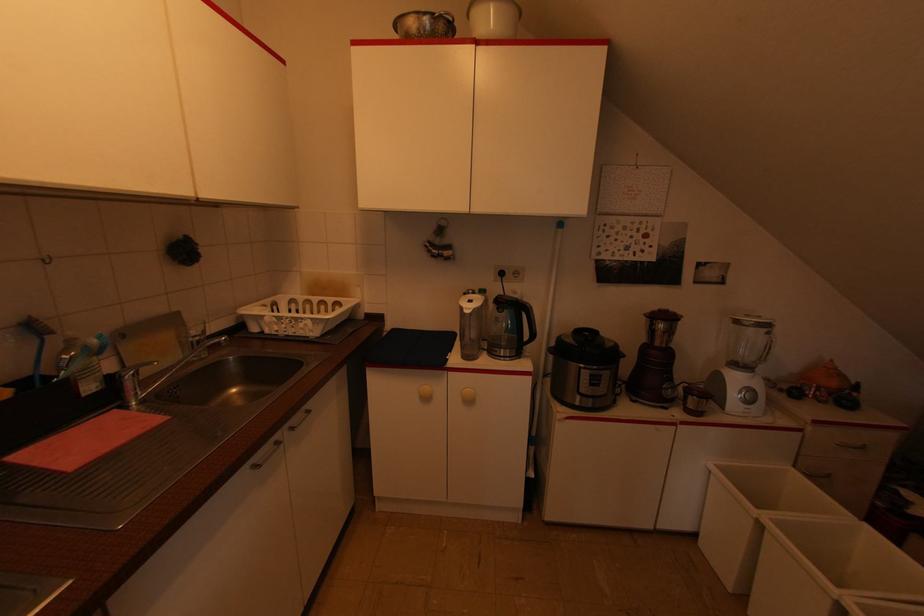
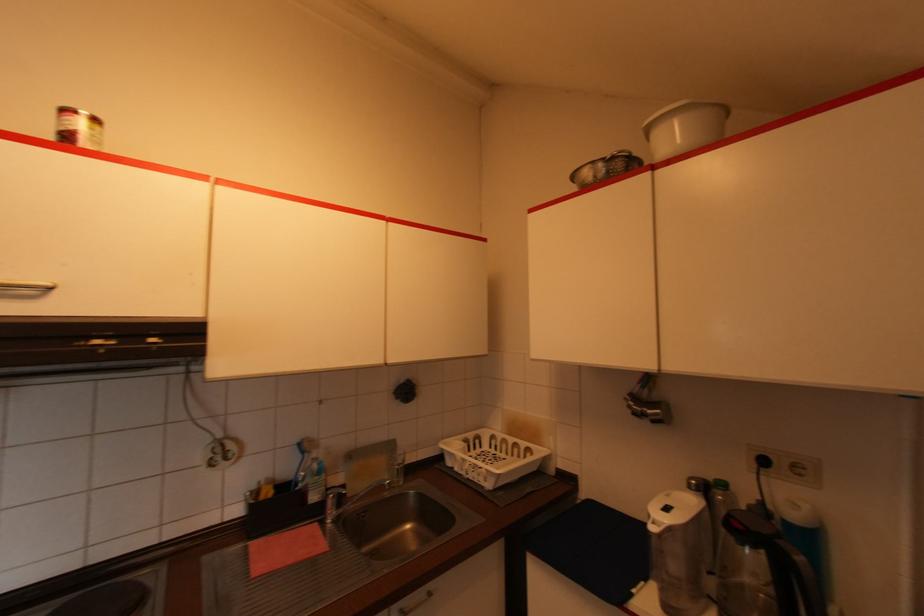
Where in the second image is the point corresponding to (x=469, y=302) from the first image?

(666, 511)